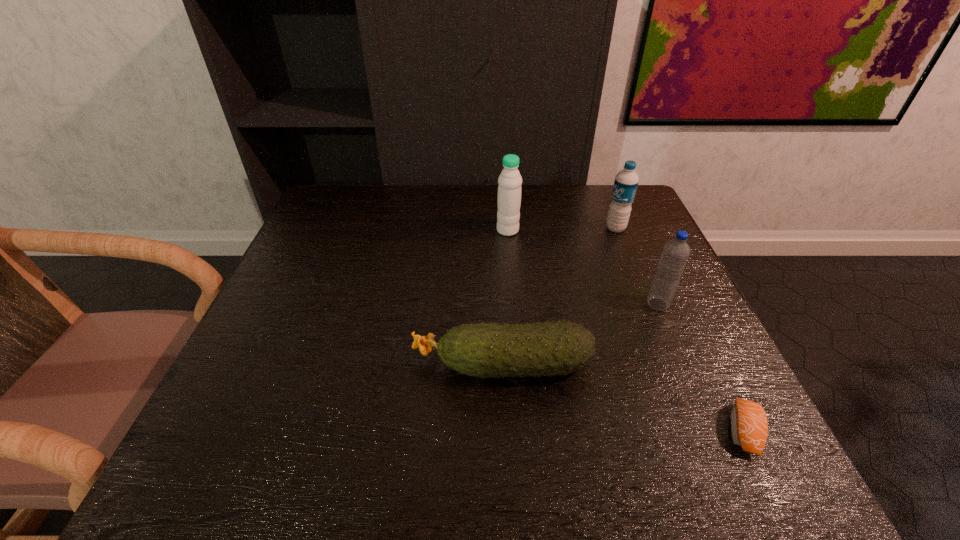
Find the location of `the leftmost water bottle`. the leftmost water bottle is located at coordinates (509, 189).

At what (x,y) coordinates should I click in order to perform the action: click on the nearest water bottle. Please return your answer as a coordinate pair (x, y). Image resolution: width=960 pixels, height=540 pixels. Looking at the image, I should click on (676, 252).

The height and width of the screenshot is (540, 960). Identify the location of cucumber. (485, 350).

Locate an element on the screen. The image size is (960, 540). the fourth tallest object is located at coordinates (485, 350).

Where is `the nearest object`? This screenshot has height=540, width=960. the nearest object is located at coordinates (749, 428).

In order to click on sushi in this screenshot , I will do `click(749, 428)`.

Locate an element on the screen. This screenshot has height=540, width=960. vacant region located 0.280m on the front of the leftmost water bottle is located at coordinates (515, 313).

The height and width of the screenshot is (540, 960). I want to click on free region located on the back of the third farthest object, so click(x=619, y=215).

Identify the location of free location located at the blossom end of the fourth farthest object. (340, 364).

This screenshot has height=540, width=960. Find the location of `vacant space located at the blossom end of the fourth farthest object`. vacant space located at the blossom end of the fourth farthest object is located at coordinates (355, 364).